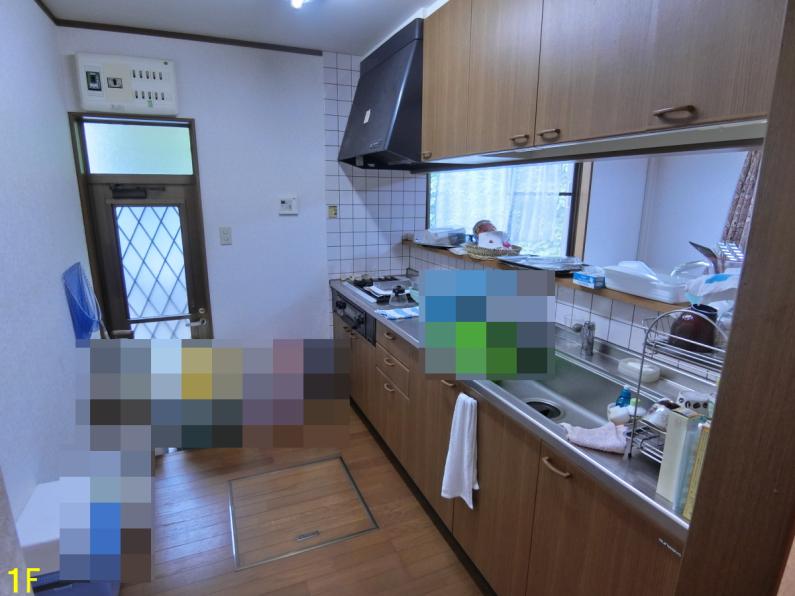
Locate an element on the screen. The height and width of the screenshot is (596, 795). stove top is located at coordinates (386, 293).